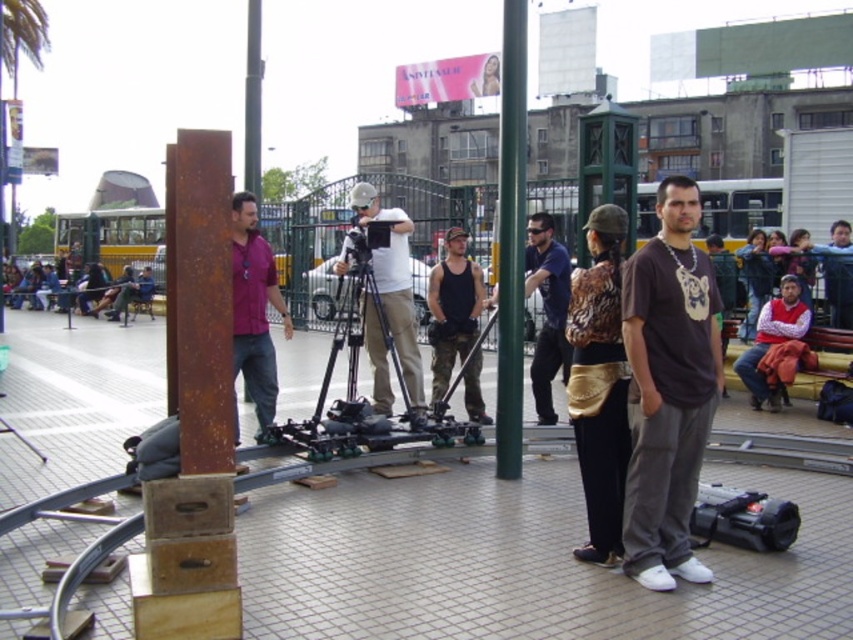
Can you confirm if rusty metal pole at center is taller than tank top at center?

Incorrect, rusty metal pole at center's height is not larger of tank top at center's.

Who is taller, rusty metal pole at center or tank top at center?

Standing taller between the two is tank top at center.

Who is more forward, [175,328] or [474,412]?

Point [175,328] is more forward.

At what (x,y) coordinates should I click in order to perform the action: click on rusty metal pole at center. Please return your answer as a coordinate pair (x, y). Looking at the image, I should click on [x=200, y=298].

Does leopard print jacket at center come behind dark blue shirt at center?

No, it is in front of dark blue shirt at center.

Is leopard print jacket at center positioned in front of dark blue shirt at center?

Yes, leopard print jacket at center is closer to the viewer.

Find the location of a particular element. The width and height of the screenshot is (853, 640). leopard print jacket at center is located at coordinates (599, 385).

Is brown matte t-shirt at center wider than black rubber camera at lower right?

Incorrect, brown matte t-shirt at center's width does not surpass black rubber camera at lower right's.

Between point (683, 294) and point (759, 522), which one is positioned behind?

Point (759, 522)

The image size is (853, 640). Find the location of `brown matte t-shirt at center`. brown matte t-shirt at center is located at coordinates (668, 388).